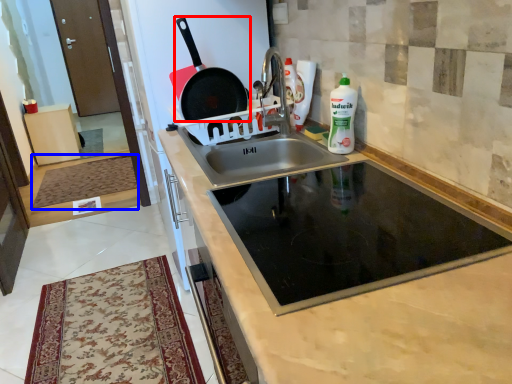
Question: Which object appears closest to the camera in this image, frying pan (highlighted by a red box) or mat (highlighted by a blue box)?

Choices:
 (A) frying pan
 (B) mat

Answer: (A)